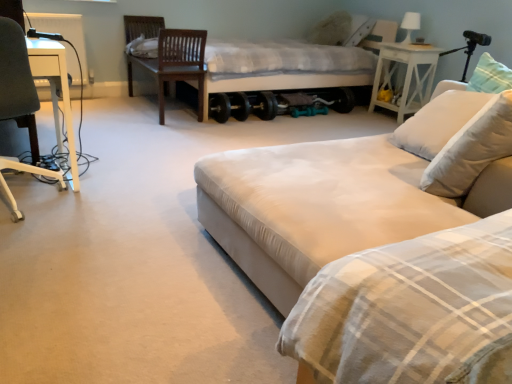
Question: Does white plastic chair at left lie behind white wood side table at right?

Choices:
 (A) yes
 (B) no

Answer: (B)

Question: From a real-world perspective, is white plastic chair at left below white wood side table at right?

Choices:
 (A) yes
 (B) no

Answer: (B)

Question: Is white plastic chair at left positioned with its back to white wood side table at right?

Choices:
 (A) no
 (B) yes

Answer: (A)

Question: Is white plastic chair at left wider than white wood side table at right?

Choices:
 (A) yes
 (B) no

Answer: (A)

Question: From a real-world perspective, is white plastic chair at left located higher than white wood side table at right?

Choices:
 (A) no
 (B) yes

Answer: (B)

Question: Is point (79, 34) closer or farther from the camera than point (414, 54)?

Choices:
 (A) farther
 (B) closer

Answer: (B)

Question: In the image, is white plastic radiator at upper left on the left side or the right side of white wood side table at right?

Choices:
 (A) right
 (B) left

Answer: (B)

Question: In terms of width, does white plastic radiator at upper left look wider or thinner when compared to white wood side table at right?

Choices:
 (A) thin
 (B) wide

Answer: (A)

Question: From a real-world perspective, relative to white wood side table at right, is white plastic radiator at upper left vertically above or below?

Choices:
 (A) above
 (B) below

Answer: (A)

Question: From the image's perspective, is white glossy table lamp at upper right located above or below dark brown wood swivel chair at upper left?

Choices:
 (A) above
 (B) below

Answer: (A)

Question: Considering the relative positions of white glossy table lamp at upper right and dark brown wood swivel chair at upper left in the image provided, is white glossy table lamp at upper right to the left or to the right of dark brown wood swivel chair at upper left?

Choices:
 (A) left
 (B) right

Answer: (B)

Question: From a real-world perspective, relative to dark brown wood swivel chair at upper left, is white glossy table lamp at upper right vertically above or below?

Choices:
 (A) below
 (B) above

Answer: (B)

Question: Is point (407, 29) positioned closer to the camera than point (152, 64)?

Choices:
 (A) closer
 (B) farther

Answer: (B)

Question: Is point (492, 142) closer or farther from the camera than point (174, 77)?

Choices:
 (A) closer
 (B) farther

Answer: (A)

Question: Is white soft pillow at right spatially inside dark brown wood swivel chair at upper left, or outside of it?

Choices:
 (A) outside
 (B) inside

Answer: (A)